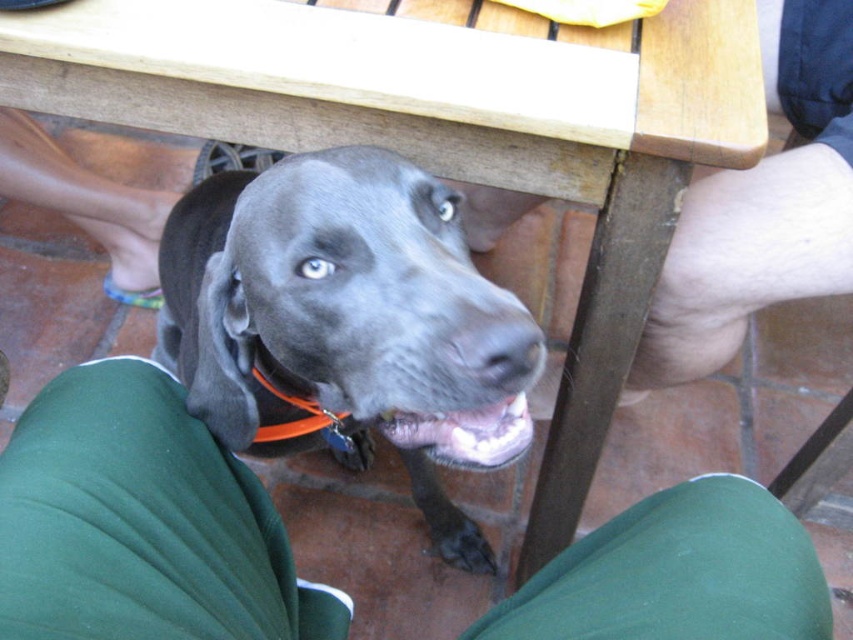
Does shiny black dog at center have a lesser width compared to orange plastic neckband at lower center?

Incorrect, shiny black dog at center's width is not less than orange plastic neckband at lower center's.

Locate an element on the screen. Image resolution: width=853 pixels, height=640 pixels. shiny black dog at center is located at coordinates (347, 323).

Image resolution: width=853 pixels, height=640 pixels. Describe the element at coordinates (141, 524) in the screenshot. I see `green fabric pants at lower center` at that location.

Which of these two, green fabric pants at lower center or orange plastic neckband at lower center, stands shorter?

Standing shorter between the two is orange plastic neckband at lower center.

At what (x,y) coordinates should I click in order to perform the action: click on green fabric pants at lower center. Please return your answer as a coordinate pair (x, y). The height and width of the screenshot is (640, 853). Looking at the image, I should click on (141, 524).

From the picture: Which is above, green fabric pants at lower center or shiny black dog at center?

Positioned higher is shiny black dog at center.

Consider the image. Does green fabric pants at lower center have a greater height compared to shiny black dog at center?

No, green fabric pants at lower center is not taller than shiny black dog at center.

Where is `green fabric pants at lower center`? Image resolution: width=853 pixels, height=640 pixels. green fabric pants at lower center is located at coordinates (141, 524).

Locate an element on the screen. green fabric pants at lower center is located at coordinates (141, 524).